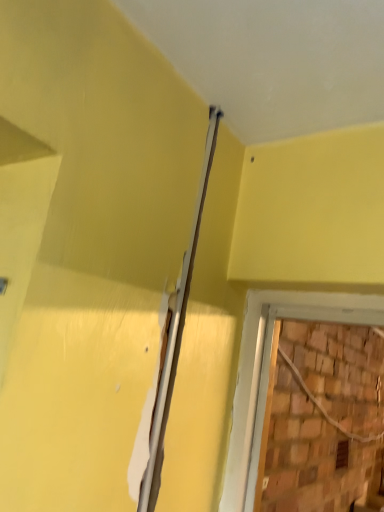
Question: Is white glossy beam at upper center taller or shorter than brown wooden hole at lower right?

Choices:
 (A) short
 (B) tall

Answer: (B)

Question: From a real-world perspective, is white glossy beam at upper center positioned above or below brown wooden hole at lower right?

Choices:
 (A) below
 (B) above

Answer: (B)

Question: From the image's perspective, is white glossy beam at upper center located above or below brown wooden hole at lower right?

Choices:
 (A) above
 (B) below

Answer: (A)

Question: From a real-world perspective, is brown wooden hole at lower right positioned above or below white glossy beam at upper center?

Choices:
 (A) below
 (B) above

Answer: (A)

Question: Is point (340, 453) closer or farther from the camera than point (175, 309)?

Choices:
 (A) closer
 (B) farther

Answer: (B)

Question: Visually, is brown wooden hole at lower right positioned to the left or to the right of white glossy beam at upper center?

Choices:
 (A) right
 (B) left

Answer: (A)

Question: Relative to white glossy beam at upper center, is brown wooden hole at lower right in front or behind?

Choices:
 (A) front
 (B) behind

Answer: (B)